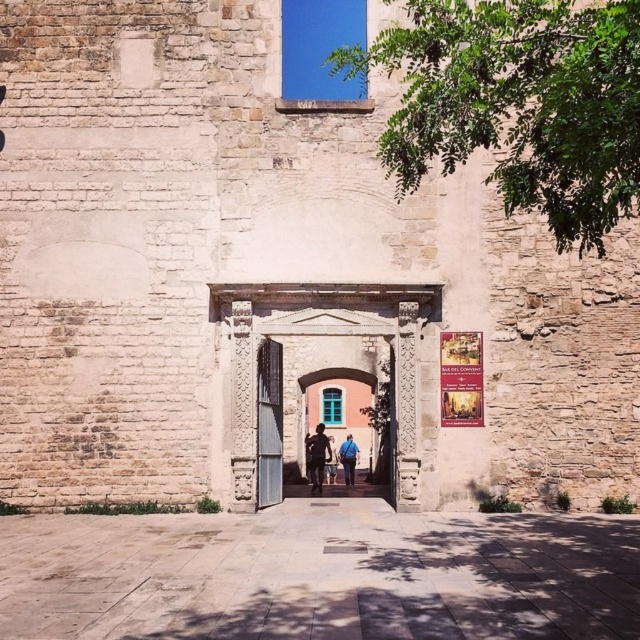
Is metallic silver door at center below blue fabric backpack at center?

No.

Image resolution: width=640 pixels, height=640 pixels. What are the coordinates of `metallic silver door at center` in the screenshot? It's located at (268, 422).

I want to click on metallic silver door at center, so click(x=268, y=422).

Who is lower down, smooth stone archway at center or dark blue jeans at center?

Positioned lower is dark blue jeans at center.

Can you confirm if smooth stone archway at center is shorter than dark blue jeans at center?

No.

Between point (292, 428) and point (321, 481), which one is positioned in front?

Positioned in front is point (321, 481).

Find the location of `smooth stone archway at center`. smooth stone archway at center is located at coordinates (308, 404).

Can you confirm if smooth stone archway at center is smaller than blue fabric jacket at center?

Actually, smooth stone archway at center might be larger than blue fabric jacket at center.

Is smooth stone archway at center above blue fabric jacket at center?

Yes, smooth stone archway at center is above blue fabric jacket at center.

Locate an element on the screen. The width and height of the screenshot is (640, 640). smooth stone archway at center is located at coordinates (308, 404).